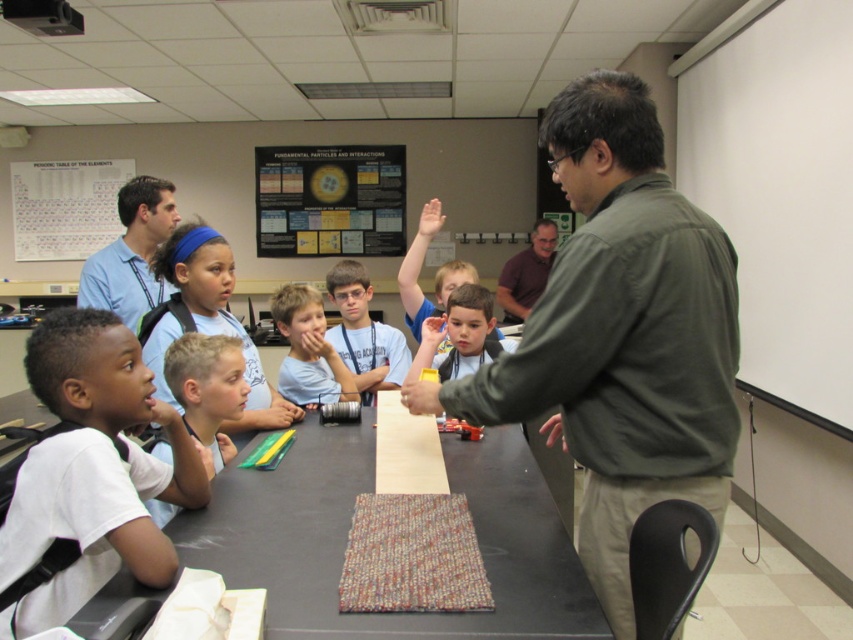
Question: Which point is closer to the camera taking this photo?

Choices:
 (A) coord(717,346)
 (B) coord(300,588)
 (C) coord(126,298)
 (D) coord(302,289)

Answer: (B)

Question: From the image, what is the correct spatial relationship of wooden textured table at center in relation to blue fabric headband at upper left?

Choices:
 (A) above
 (B) below

Answer: (B)

Question: Among these points, which one is farthest from the camera?

Choices:
 (A) (157, 182)
 (B) (305, 147)

Answer: (B)

Question: Where is green matte shirt at center located in relation to metallic silver poster at upper center in the image?

Choices:
 (A) above
 (B) below

Answer: (B)

Question: Among these objects, which one is nearest to the camera?

Choices:
 (A) purple shirt at center
 (B) matte blue shirt at center

Answer: (B)

Question: Is white matte shirt at lower left wider than metallic silver poster at upper center?

Choices:
 (A) yes
 (B) no

Answer: (B)